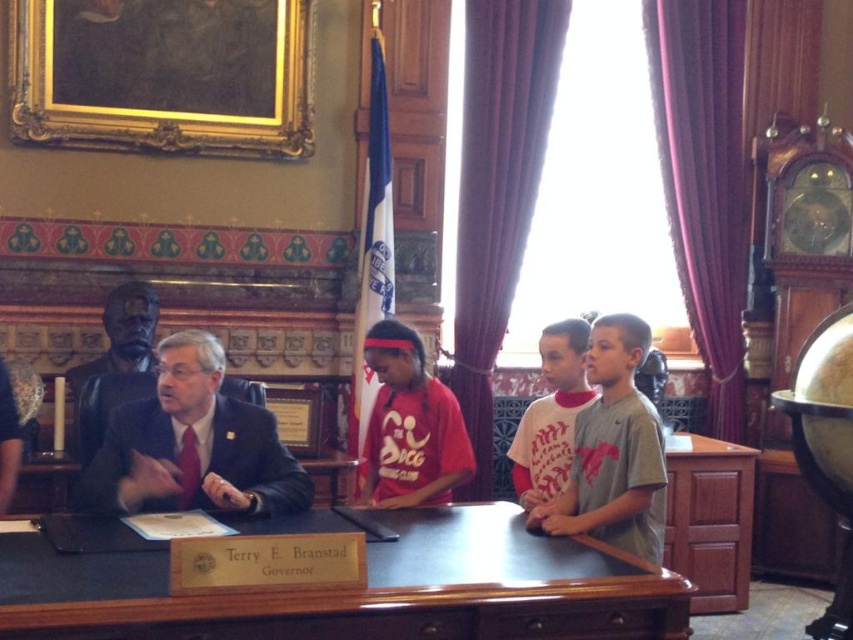
Between dark suit at center and white cotton shirt at center, which one is positioned higher?

Positioned higher is white cotton shirt at center.

Is point (224, 468) behind point (555, 358)?

No.

This screenshot has height=640, width=853. What are the coordinates of `dark suit at center` in the screenshot? It's located at (193, 444).

Can you confirm if red cotton shirt at center is smaller than white cotton shirt at center?

Incorrect, red cotton shirt at center is not smaller in size than white cotton shirt at center.

Is red cotton shirt at center taller than white cotton shirt at center?

Yes, red cotton shirt at center is taller than white cotton shirt at center.

Does point (625, 333) come farther from viewer compared to point (560, 358)?

No.

Identify the location of red cotton shirt at center. (614, 451).

Does dark suit at center appear over red cotton shirt at center?

No.

Between point (189, 353) and point (643, 397), which one is positioned in front?

Positioned in front is point (189, 353).

Who is more distant from viewer, [259,484] or [653,492]?

The point [259,484] is more distant.

Identify the location of dark suit at center. (193, 444).